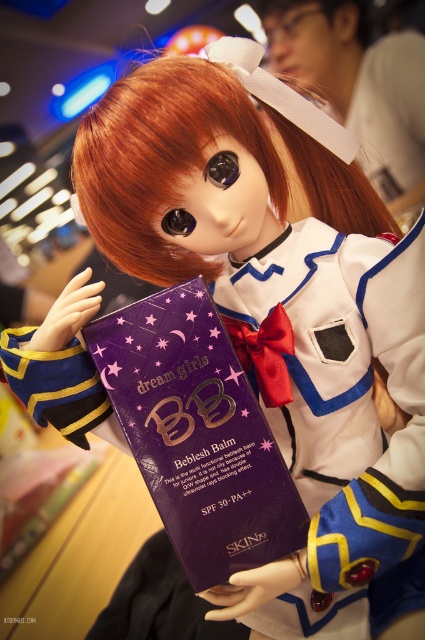
Between point (288, 515) and point (300, 161), which one is positioned behind?

Point (300, 161)

The height and width of the screenshot is (640, 425). I want to click on purple matte bb cream at center, so click(198, 433).